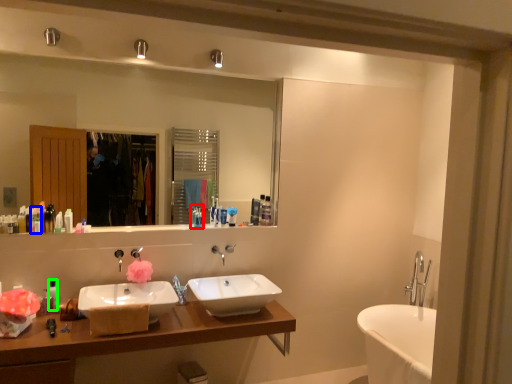
Question: Based on their relative distances, which object is nearer to toiletry (highlighted by a red box)? Choose from toiletry (highlighted by a blue box) and toiletry (highlighted by a green box).

Choices:
 (A) toiletry
 (B) toiletry

Answer: (B)